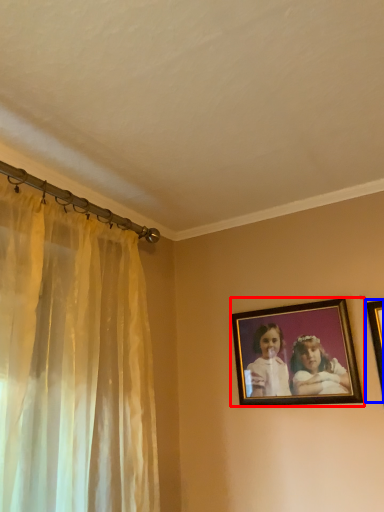
Question: Among these objects, which one is farthest to the camera, picture frame (highlighted by a red box) or picture frame (highlighted by a blue box)?

Choices:
 (A) picture frame
 (B) picture frame

Answer: (A)